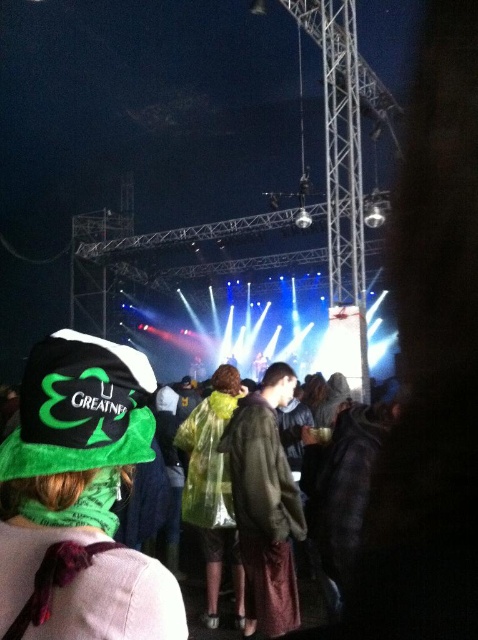
Question: Among these points, which one is farthest from the camera?

Choices:
 (A) (235, 440)
 (B) (97, 506)
 (C) (108, 593)

Answer: (A)

Question: Is green fabric hat at upper left above green fabric hat at lower left?

Choices:
 (A) yes
 (B) no

Answer: (A)

Question: Which object is closer to the camera taking this photo?

Choices:
 (A) green fabric jacket at center
 (B) transparent plastic poncho at center
 (C) green fabric hat at upper left
 (D) green fabric hat at lower left

Answer: (D)

Question: Does green fabric hat at lower left have a smaller size compared to transparent plastic poncho at center?

Choices:
 (A) no
 (B) yes

Answer: (B)

Question: Is green fabric hat at lower left to the right of transparent plastic poncho at center from the viewer's perspective?

Choices:
 (A) yes
 (B) no

Answer: (B)

Question: Which of the following is the closest to the observer?

Choices:
 (A) coord(225,502)
 (B) coord(249,420)
 (C) coord(54,337)

Answer: (C)